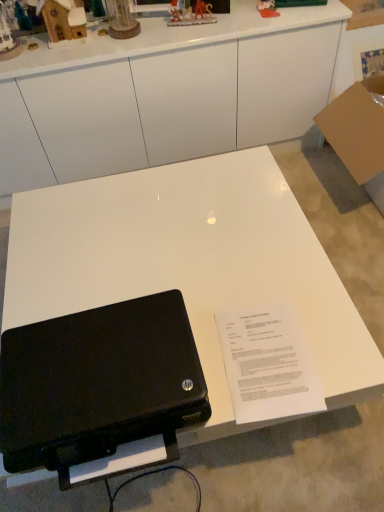
Where is `vacant region to the left of white paper at center`? The image size is (384, 512). vacant region to the left of white paper at center is located at coordinates (206, 369).